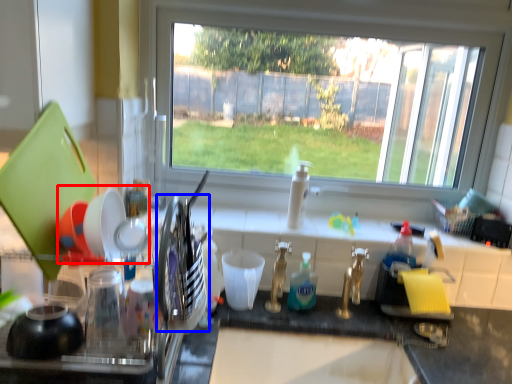
Question: Which object appears closest to the camera in this image, tableware (highlighted by a red box) or tableware (highlighted by a blue box)?

Choices:
 (A) tableware
 (B) tableware

Answer: (B)